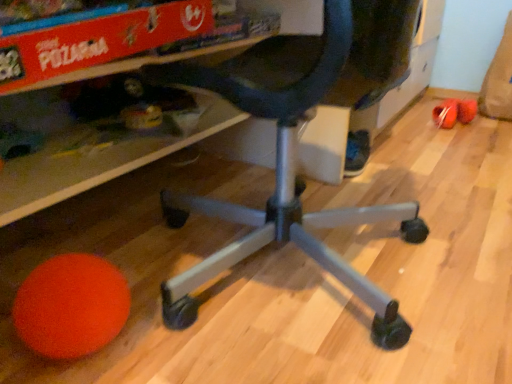
Locate an element on the screen. vacant space that is in between black matte office chair at center and rubberized plastic ball at lower left is located at coordinates (402, 166).